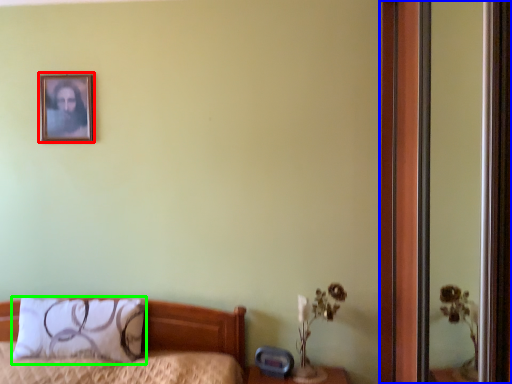
Question: Estimate the real-world distances between objects in this image. Which object is closer to picture frame (highlighted by a red box), screen door (highlighted by a blue box) or pillow (highlighted by a green box)?

Choices:
 (A) screen door
 (B) pillow

Answer: (B)